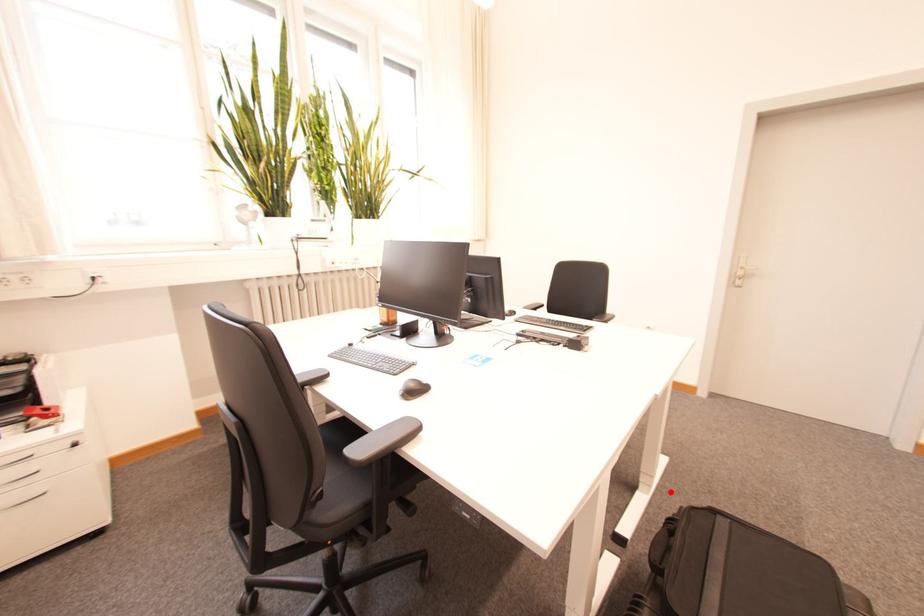
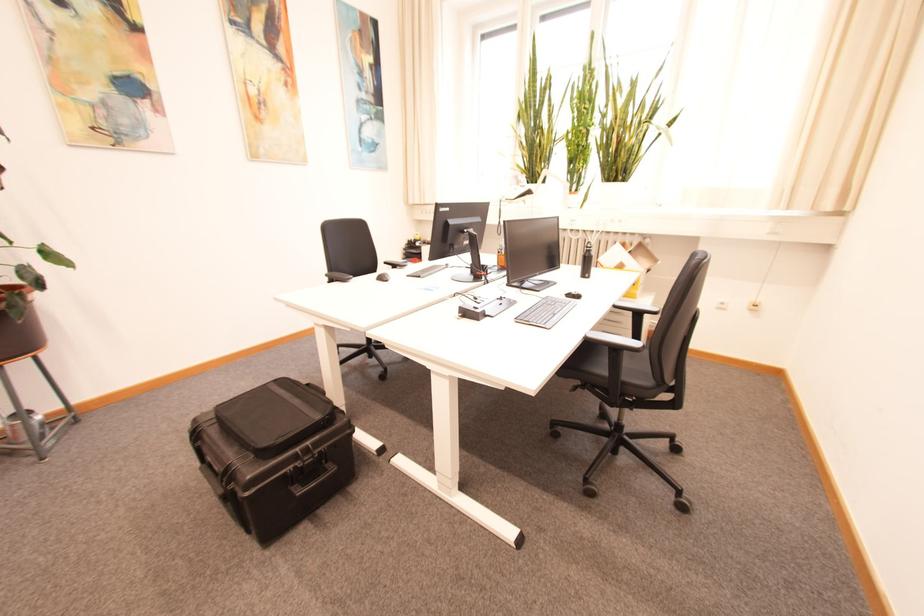
Locate, in the second image, the point that corresponds to the highlighted location in the first image.

(463, 519)